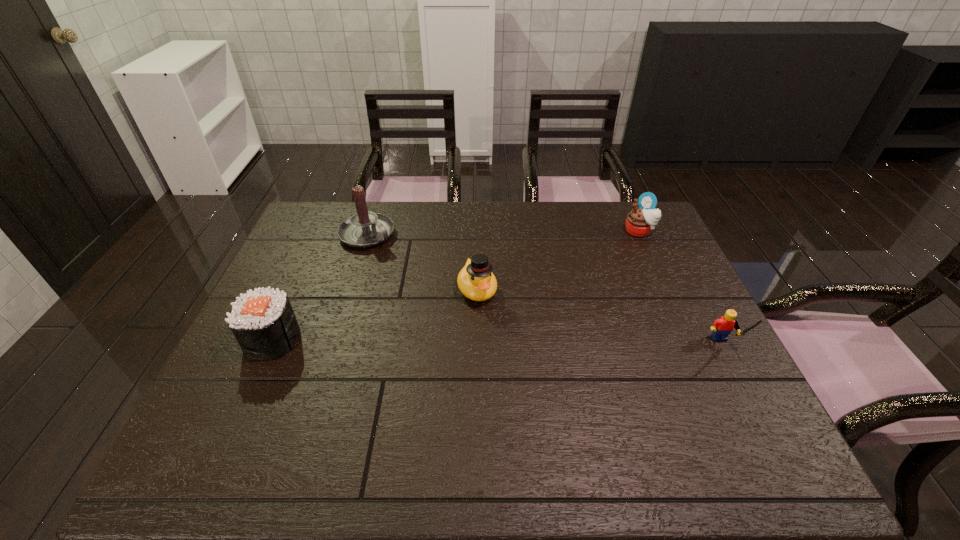
Image resolution: width=960 pixels, height=540 pixels. In order to click on empty space that is in between the muffin and the sushi in this screenshot , I will do `click(456, 285)`.

This screenshot has width=960, height=540. I want to click on the fourth closest object to the muffin, so (x=263, y=322).

At what (x,y) coordinates should I click in order to perform the action: click on object that stands as the third closest to the candle. Please return your answer as a coordinate pair (x, y). The height and width of the screenshot is (540, 960). Looking at the image, I should click on click(x=640, y=221).

This screenshot has height=540, width=960. What are the coordinates of `free space that satisfies the following two spatial constraints: 1. on the back side of the muffin; 2. on the right side of the candle` in the screenshot? It's located at (369, 231).

Locate an element on the screen. The image size is (960, 540). vacant space that satisfies the following two spatial constraints: 1. on the back side of the muffin; 2. on the left side of the sushi is located at coordinates (321, 231).